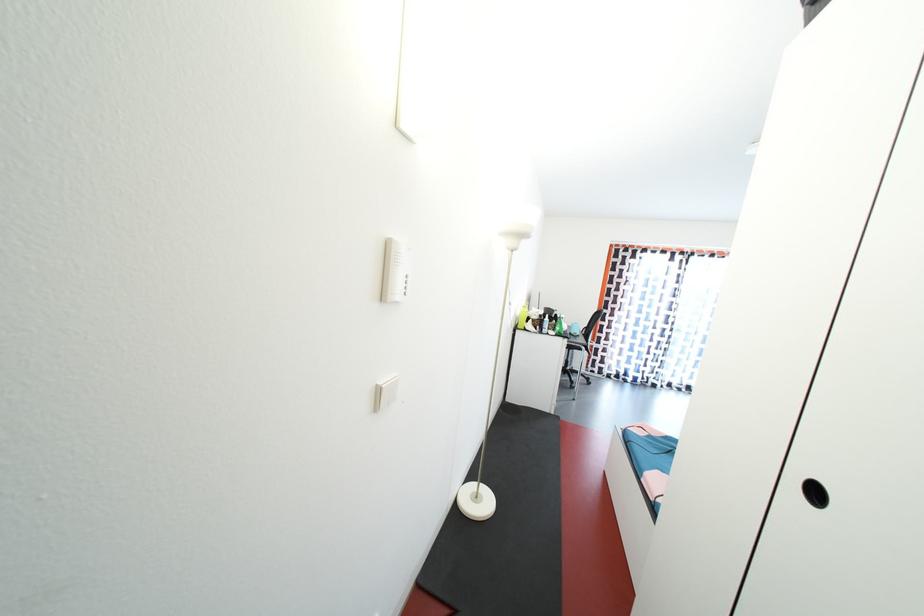
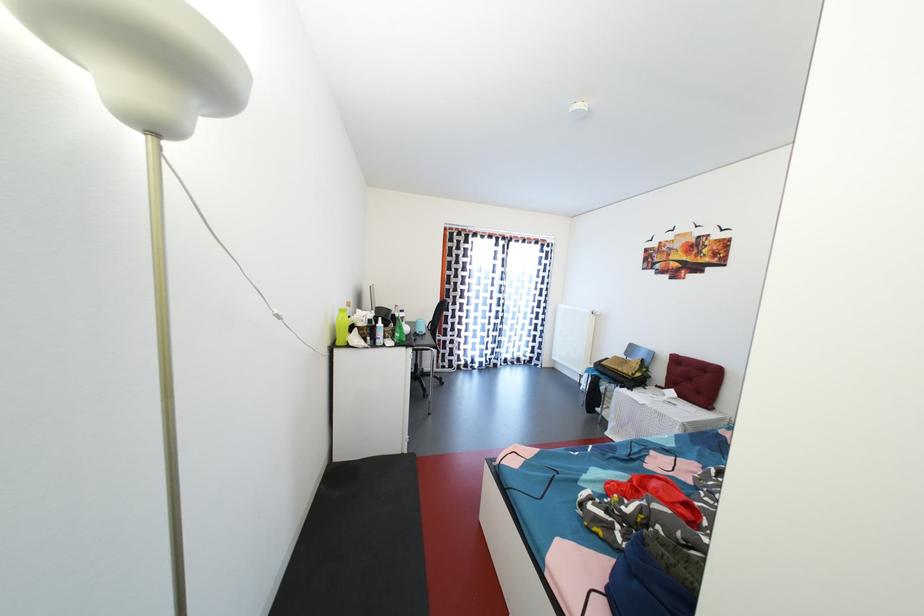
The point at (546, 321) is marked in the first image. Where is the corresponding point in the second image?

(377, 326)